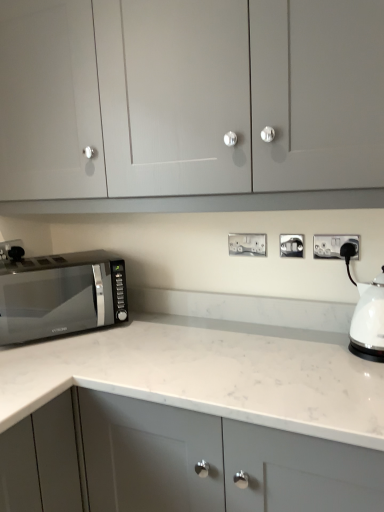
Question: From the image's perspective, is satin silver socket at center, the 2th electric outlet from the front, beneath white marble countertop at center?

Choices:
 (A) no
 (B) yes

Answer: (A)

Question: Is white marble countertop at center a part of satin silver socket at center, the 3th electric outlet from the back?

Choices:
 (A) no
 (B) yes

Answer: (A)

Question: Is satin silver socket at center, the 3th electric outlet from the back, further to camera compared to white marble countertop at center?

Choices:
 (A) no
 (B) yes

Answer: (B)

Question: Is satin silver socket at center, the 2th electric outlet from the front, positioned in front of white marble countertop at center?

Choices:
 (A) no
 (B) yes

Answer: (A)

Question: Is satin silver socket at center, the 2th electric outlet from the front, positioned with its back to white marble countertop at center?

Choices:
 (A) no
 (B) yes

Answer: (A)

Question: Considering the positions of white plastic electric outlet at center right, which is counted as the fourth electric outlet, starting from the back, and satin silver socket at lower left, the first electric outlet when ordered from back to front, in the image, is white plastic electric outlet at center right, which is counted as the fourth electric outlet, starting from the back, taller or shorter than satin silver socket at lower left, the first electric outlet when ordered from back to front,?

Choices:
 (A) short
 (B) tall

Answer: (B)

Question: Looking at the image, does white plastic electric outlet at center right, which is counted as the fourth electric outlet, starting from the back, seem bigger or smaller compared to satin silver socket at lower left, which is counted as the fourth electric outlet, starting from the front?

Choices:
 (A) big
 (B) small

Answer: (B)

Question: Do you think white plastic electric outlet at center right, the first electric outlet from the front, is within satin silver socket at lower left, arranged as the 1th electric outlet when viewed from the left, or outside of it?

Choices:
 (A) inside
 (B) outside

Answer: (B)

Question: Looking at their shapes, would you say white plastic electric outlet at center right, which is counted as the fourth electric outlet, starting from the back, is wider or thinner than satin silver socket at lower left, which is counted as the fourth electric outlet, starting from the front?

Choices:
 (A) wide
 (B) thin

Answer: (B)

Question: Is satin silver socket at lower left, the first electric outlet when ordered from back to front, to the left or to the right of white plastic electric outlet at center right, which ranks as the fourth electric outlet in left-to-right order, in the image?

Choices:
 (A) right
 (B) left

Answer: (B)

Question: Relative to white plastic electric outlet at center right, which ranks as the fourth electric outlet in left-to-right order, is satin silver socket at lower left, the fourth electric outlet in the right-to-left sequence, in front or behind?

Choices:
 (A) front
 (B) behind

Answer: (B)

Question: From the image's perspective, is satin silver socket at lower left, arranged as the 1th electric outlet when viewed from the left, above or below white plastic electric outlet at center right, which ranks as the fourth electric outlet in left-to-right order?

Choices:
 (A) above
 (B) below

Answer: (B)

Question: In terms of size, does satin silver socket at lower left, the first electric outlet when ordered from back to front, appear bigger or smaller than white plastic electric outlet at center right, the first electric outlet from the front?

Choices:
 (A) big
 (B) small

Answer: (A)

Question: From a real-world perspective, is white marble countertop at center above or below silver metallic socket at center, the 2th electric outlet when ordered from back to front?

Choices:
 (A) above
 (B) below

Answer: (B)

Question: Looking at the image, does white marble countertop at center seem bigger or smaller compared to silver metallic socket at center, the 2th electric outlet when ordered from back to front?

Choices:
 (A) small
 (B) big

Answer: (B)